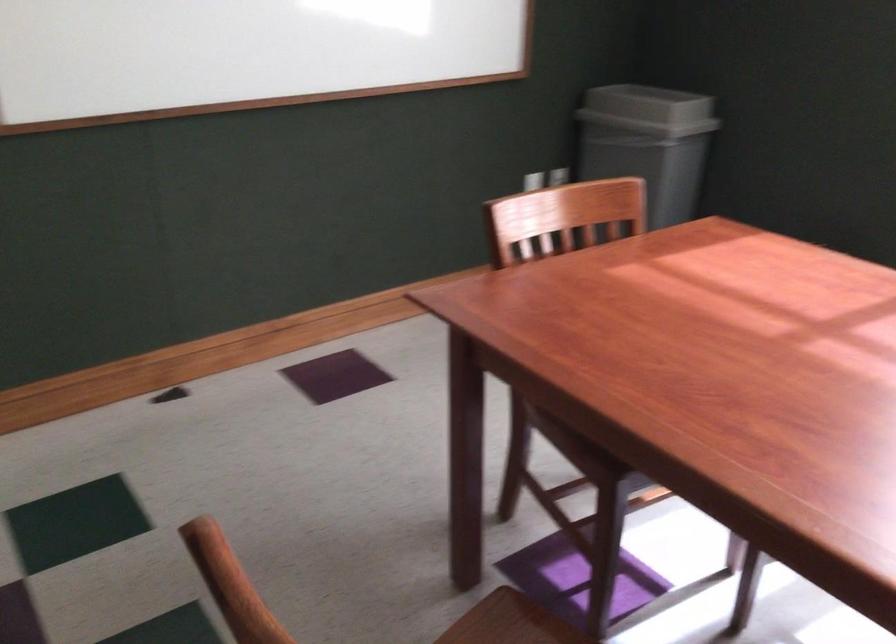
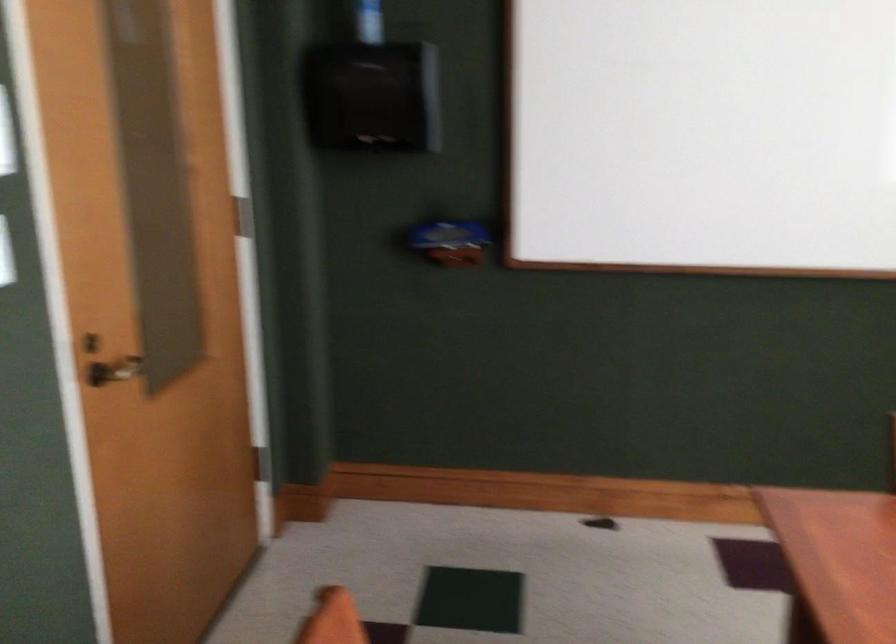
Question: How did the camera likely rotate?

Choices:
 (A) Left
 (B) Right
 (C) Up
 (D) Down

Answer: (A)